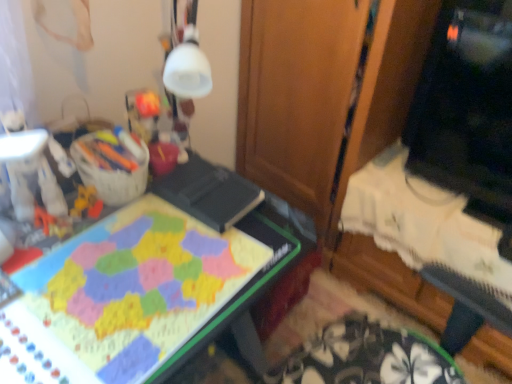
Question: Would you say matte plastic board game at center is to the left or to the right of black glossy monitor at upper right in the picture?

Choices:
 (A) left
 (B) right

Answer: (A)

Question: Looking at their shapes, would you say matte plastic board game at center is wider or thinner than black glossy monitor at upper right?

Choices:
 (A) wide
 (B) thin

Answer: (A)

Question: Which of these objects is positioned farthest from the matte plastic board game at center?

Choices:
 (A) black glossy monitor at upper right
 (B) plush yellow toy at left
 (C) wooden at center

Answer: (A)

Question: Which of these objects is positioned closest to the black glossy monitor at upper right?

Choices:
 (A) plush yellow toy at left
 (B) matte plastic board game at center
 (C) wooden at center

Answer: (C)